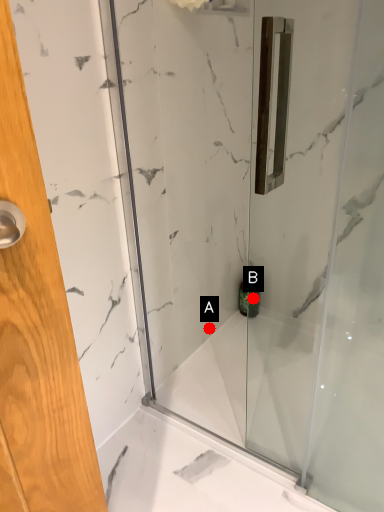
Question: Two points are circled on the image, labeled by A and B beside each circle. Which point is closer to the camera taking this photo?

Choices:
 (A) A is closer
 (B) B is closer

Answer: (B)